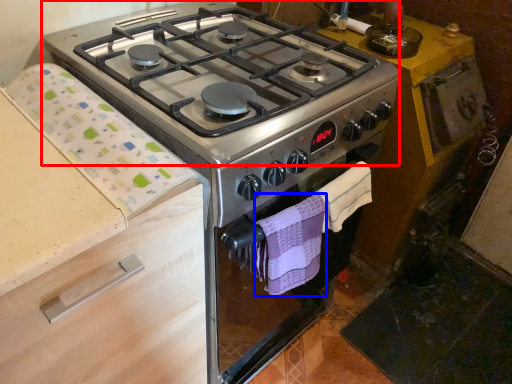
Question: Which of the following is the farthest to the observer, gas stove (highlighted by a red box) or hand towel (highlighted by a blue box)?

Choices:
 (A) gas stove
 (B) hand towel

Answer: (B)